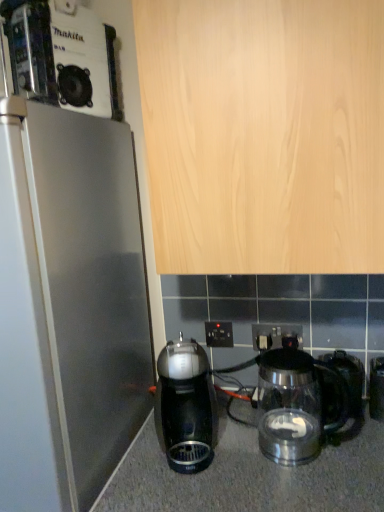
This screenshot has height=512, width=384. What do you see at coordinates (276, 336) in the screenshot?
I see `black plastic electric outlet at center, which is counted as the 1th electric outlet, starting from the right` at bounding box center [276, 336].

The height and width of the screenshot is (512, 384). What are the coordinates of `translucent glass coffee pot at lower right` in the screenshot? It's located at (340, 387).

Measure the distance between shiny black coffee maker at center, the second kitchen appliance in the right-to-left sequence, and camera.

They are 37.71 inches apart.

At what (x,y) coordinates should I click in order to perform the action: click on black plastic electric outlet at center, the 2th electric outlet in the right-to-left sequence. Please return your answer as a coordinate pair (x, y). Looking at the image, I should click on (219, 334).

Where is `coffeepot located behind the transparent glass kettle at lower center, the first kitchen appliance positioned from the right`? coffeepot located behind the transparent glass kettle at lower center, the first kitchen appliance positioned from the right is located at coordinates (340, 387).

From the image's perspective, who appears lower, transparent glass kettle at lower center, marked as the 2th kitchen appliance in a left-to-right arrangement, or translucent glass coffee pot at lower right?

transparent glass kettle at lower center, marked as the 2th kitchen appliance in a left-to-right arrangement, appears lower in the image.

Considering the relative positions of transparent glass kettle at lower center, the first kitchen appliance positioned from the right, and translucent glass coffee pot at lower right in the image provided, is transparent glass kettle at lower center, the first kitchen appliance positioned from the right, to the left or to the right of translucent glass coffee pot at lower right?

From the image, it's evident that transparent glass kettle at lower center, the first kitchen appliance positioned from the right, is to the left of translucent glass coffee pot at lower right.

Is transparent glass kettle at lower center, the first kitchen appliance positioned from the right, facing away from translucent glass coffee pot at lower right?

Yes, transparent glass kettle at lower center, the first kitchen appliance positioned from the right,'s orientation is away from translucent glass coffee pot at lower right.

How many degrees apart are the facing directions of black plastic kettle at lower right and metallic silver coffee maker at upper left?

22.4 degrees separate the facing orientations of black plastic kettle at lower right and metallic silver coffee maker at upper left.

From a real-world perspective, is black plastic kettle at lower right over metallic silver coffee maker at upper left?

Incorrect, from a real-world perspective, black plastic kettle at lower right is lower than metallic silver coffee maker at upper left.

Is black plastic kettle at lower right positioned beyond the bounds of metallic silver coffee maker at upper left?

Yes, black plastic kettle at lower right is not within metallic silver coffee maker at upper left.

Is point (382, 388) closer to camera compared to point (114, 74)?

No.

Is black plastic electric outlet at center, which is counted as the 1th electric outlet, starting from the right, spatially inside black plastic electric outlet at center, the first electric outlet viewed from the left, or outside of it?

black plastic electric outlet at center, which is counted as the 1th electric outlet, starting from the right, is not inside black plastic electric outlet at center, the first electric outlet viewed from the left, it's outside.

Identify the location of electric outlet below the black plastic electric outlet at center, the 2th electric outlet in the right-to-left sequence (from a real-world perspective). The image size is (384, 512). (276, 336).

Is point (271, 344) farther from camera compared to point (226, 327)?

No.

Looking at this image, between shiny black coffee maker at center, the second kitchen appliance in the right-to-left sequence, and transparent glass kettle at lower center, the first kitchen appliance positioned from the right, which one has smaller size?

Smaller between the two is shiny black coffee maker at center, the second kitchen appliance in the right-to-left sequence.

Identify the location of kitchen appliance on the left of transparent glass kettle at lower center, the first kitchen appliance positioned from the right. (185, 406).

Which point is more distant from viewer, (x=180, y=438) or (x=313, y=421)?

Point (x=180, y=438)

Which object is positioned more to the left, shiny black coffee maker at center, the first kitchen appliance from the left, or transparent glass kettle at lower center, marked as the 2th kitchen appliance in a left-to-right arrangement?

shiny black coffee maker at center, the first kitchen appliance from the left, is more to the left.

The width and height of the screenshot is (384, 512). In the image, there is a metallic silver coffee maker at upper left. Find the location of `coffeepot below it (from a real-world perspective)`. coffeepot below it (from a real-world perspective) is located at coordinates (340, 387).

From the image's perspective, which one is positioned lower, translucent glass coffee pot at lower right or metallic silver coffee maker at upper left?

translucent glass coffee pot at lower right is shown below in the image.

Consider the image. From a real-world perspective, is translucent glass coffee pot at lower right on top of metallic silver coffee maker at upper left?

No, from a real-world perspective, translucent glass coffee pot at lower right is not above metallic silver coffee maker at upper left.

Is translucent glass coffee pot at lower right looking in the opposite direction of metallic silver coffee maker at upper left?

translucent glass coffee pot at lower right is not turned away from metallic silver coffee maker at upper left.

Relative to metallic silver coffee maker at upper left, is shiny black coffee maker at center, the second kitchen appliance in the right-to-left sequence, in front or behind?

shiny black coffee maker at center, the second kitchen appliance in the right-to-left sequence, is positioned farther from the viewer than metallic silver coffee maker at upper left.

At what (x,y) coordinates should I click in order to perform the action: click on coffee maker above the shiny black coffee maker at center, the second kitchen appliance in the right-to-left sequence (from a real-world perspective). Please return your answer as a coordinate pair (x, y). The width and height of the screenshot is (384, 512). Looking at the image, I should click on (59, 56).

From a real-world perspective, is shiny black coffee maker at center, the first kitchen appliance from the left, beneath metallic silver coffee maker at upper left?

Yes, from a real-world perspective, shiny black coffee maker at center, the first kitchen appliance from the left, is under metallic silver coffee maker at upper left.

Is shiny black coffee maker at center, the second kitchen appliance in the right-to-left sequence, located within translucent glass coffee pot at lower right?

Definitely not — shiny black coffee maker at center, the second kitchen appliance in the right-to-left sequence, is not inside translucent glass coffee pot at lower right.

What's the angular difference between translucent glass coffee pot at lower right and shiny black coffee maker at center, the first kitchen appliance from the left,'s facing directions?

15 degrees.

Considering the positions of point (356, 411) and point (161, 372), is point (356, 411) closer or farther from the camera than point (161, 372)?

Point (356, 411) is closer to the camera than point (161, 372).

Where is `kitchen appliance that is the 2nd one when counting forward from the translucent glass coffee pot at lower right`? The height and width of the screenshot is (512, 384). kitchen appliance that is the 2nd one when counting forward from the translucent glass coffee pot at lower right is located at coordinates (294, 406).

I want to click on coffee maker above the black plastic kettle at lower right (from the image's perspective), so click(x=59, y=56).

Consider the image. From the image, which object appears to be nearer to transparent glass kettle at lower center, marked as the 2th kitchen appliance in a left-to-right arrangement, black plastic kettle at lower right or black plastic electric outlet at center, the 2th electric outlet in the right-to-left sequence?

black plastic kettle at lower right.

From the image, which object appears to be farther from translucent glass coffee pot at lower right, black plastic kettle at lower right or transparent glass kettle at lower center, the first kitchen appliance positioned from the right?

transparent glass kettle at lower center, the first kitchen appliance positioned from the right.

Consider the image. Looking at the image, which one is located further to black plastic electric outlet at center, the first electric outlet viewed from the left, black plastic kettle at lower right or black plastic electric outlet at center, which is counted as the 1th electric outlet, starting from the right?

A: black plastic kettle at lower right lies further to black plastic electric outlet at center, the first electric outlet viewed from the left, than the other object.

When comparing their distances from black plastic kettle at lower right, does black plastic electric outlet at center, the 2th electric outlet in the right-to-left sequence, or shiny black coffee maker at center, the first kitchen appliance from the left, seem further?

Result: shiny black coffee maker at center, the first kitchen appliance from the left, is further to black plastic kettle at lower right.

Which object lies nearer to the anchor point translucent glass coffee pot at lower right, metallic silver coffee maker at upper left or black plastic kettle at lower right?

black plastic kettle at lower right lies closer to translucent glass coffee pot at lower right than the other object.

Considering their positions, is translucent glass coffee pot at lower right positioned further to metallic silver coffee maker at upper left than black plastic electric outlet at center, which is counted as the 1th electric outlet, starting from the right?

translucent glass coffee pot at lower right lies further to metallic silver coffee maker at upper left than the other object.

Estimate the real-world distances between objects in this image. Which object is further from metallic silver coffee maker at upper left, black plastic electric outlet at center, the 2th electric outlet in the right-to-left sequence, or transparent glass kettle at lower center, marked as the 2th kitchen appliance in a left-to-right arrangement?

transparent glass kettle at lower center, marked as the 2th kitchen appliance in a left-to-right arrangement, is further to metallic silver coffee maker at upper left.

Estimate the real-world distances between objects in this image. Which object is further from metallic silver coffee maker at upper left, translucent glass coffee pot at lower right or transparent glass kettle at lower center, the first kitchen appliance positioned from the right?

The object further to metallic silver coffee maker at upper left is translucent glass coffee pot at lower right.

Locate an element on the screen. kitchen appliance between black plastic electric outlet at center, the second electric outlet positioned from the left, and black plastic kettle at lower right is located at coordinates (294, 406).

This screenshot has height=512, width=384. I want to click on coffeepot situated between shiny black coffee maker at center, the second kitchen appliance in the right-to-left sequence, and black plastic kettle at lower right from left to right, so click(x=340, y=387).

Identify the location of kitchen appliance between black plastic electric outlet at center, the 2th electric outlet in the right-to-left sequence, and black plastic kettle at lower right. This screenshot has height=512, width=384. (294, 406).

The height and width of the screenshot is (512, 384). What are the coordinates of `electric outlet between shiny black coffee maker at center, the second kitchen appliance in the right-to-left sequence, and black plastic electric outlet at center, the 2th electric outlet in the right-to-left sequence, along the z-axis` in the screenshot? It's located at (276, 336).